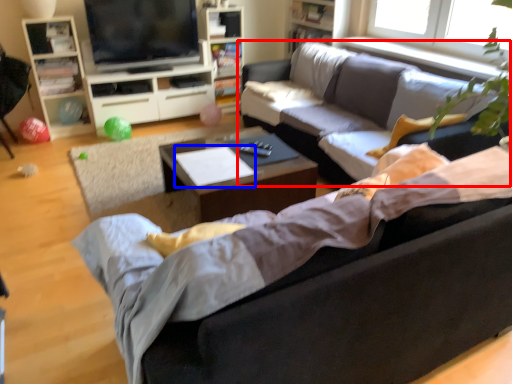
Question: Among these objects, which one is farthest to the camera, studio couch (highlighted by a red box) or sheet (highlighted by a blue box)?

Choices:
 (A) studio couch
 (B) sheet

Answer: (B)